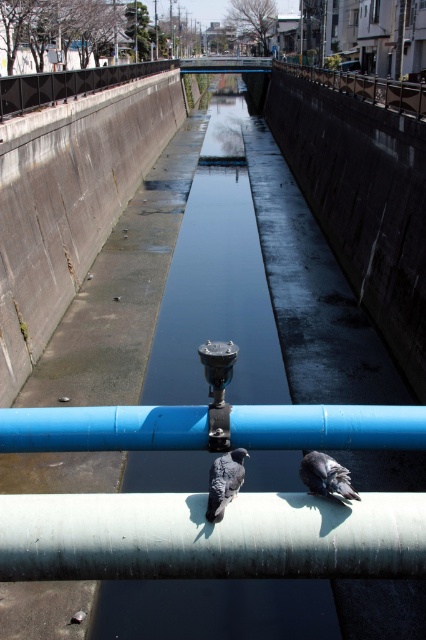
Question: Which of the following is the closest to the observer?

Choices:
 (A) blue plastic pipe at center
 (B) shiny black bird at center
 (C) smooth metal railing at upper center
 (D) white smooth water pipe at center

Answer: (D)

Question: Is blue plastic pipe at center smaller than shiny black bird at center?

Choices:
 (A) no
 (B) yes

Answer: (A)

Question: Based on their relative distances, which object is nearer to the shiny black bird at center?

Choices:
 (A) smooth metal railing at upper center
 (B) gray speckled pigeon at center
 (C) white smooth water pipe at center
 (D) blue plastic pipe at center

Answer: (B)

Question: Is the position of smooth metal railing at upper center less distant than that of gray speckled pigeon at center?

Choices:
 (A) no
 (B) yes

Answer: (A)

Question: Which of the following is the closest to the observer?

Choices:
 (A) smooth metal railing at upper center
 (B) white smooth water pipe at center
 (C) shiny black bird at center

Answer: (B)

Question: Does white smooth water pipe at center lie behind gray speckled pigeon at center?

Choices:
 (A) no
 (B) yes

Answer: (A)